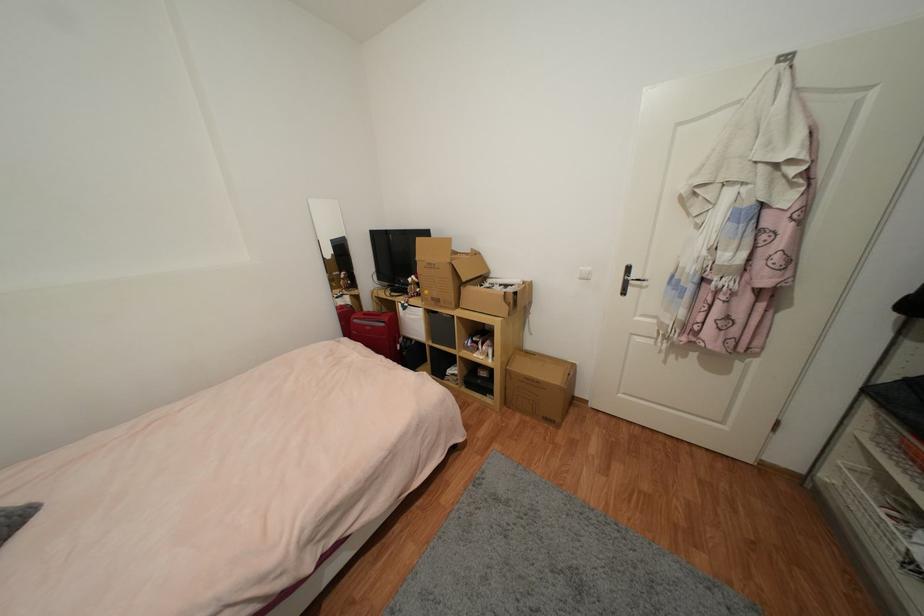
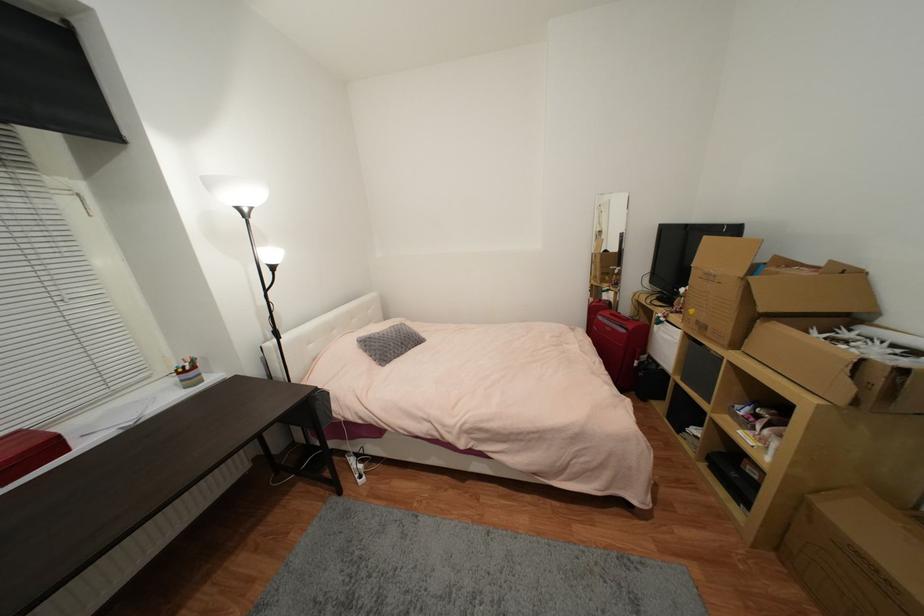
In the second image, find the point that corresponds to point 359,322 in the first image.

(603, 318)